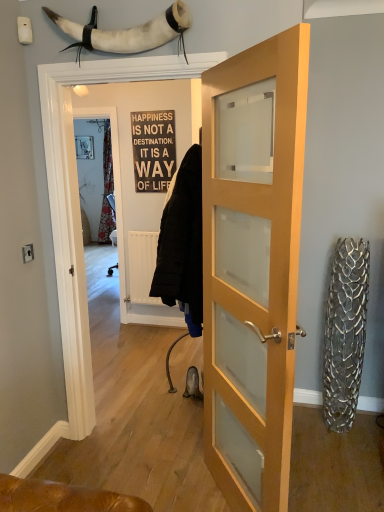
This screenshot has width=384, height=512. What are the coordinates of `vacant area that lies in front of wooden door at center, arranged as the 1th door when viewed from the left` in the screenshot? It's located at (158, 482).